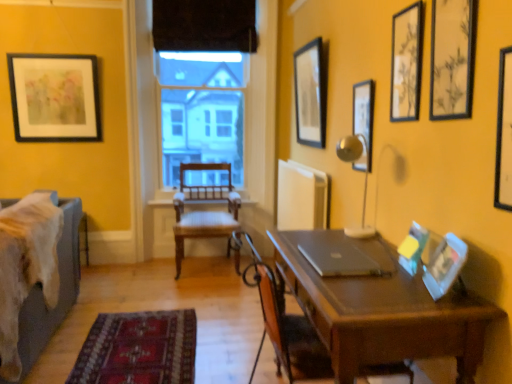
Question: From their relative heights in the image, would you say matte plastic picture frame at right, which appears as the fifth picture frame when viewed from the left, is taller or shorter than wooden picture frame at upper right, which is the 4th picture frame from back to front?

Choices:
 (A) tall
 (B) short

Answer: (B)

Question: Relative to wooden picture frame at upper right, acting as the sixth picture frame starting from the left, is matte plastic picture frame at right, which appears as the fourth picture frame when viewed from the right, in front or behind?

Choices:
 (A) front
 (B) behind

Answer: (A)

Question: Which is nearer to the brown wooden chair at center, placed as the 1th chair when sorted from front to back?

Choices:
 (A) wooden picture frame at upper right, acting as the seventh picture frame starting from the left
 (B) matte black picture frame at upper right, positioned as the 6th picture frame in right-to-left order
 (C) transparent glass window at center
 (D) matte plastic picture frame at right, the 4th picture frame when ordered from left to right
 (E) wooden chair at center

Answer: (D)

Question: Which is nearer to the velvet blue bed at left?

Choices:
 (A) matte black picture frame at upper right, positioned as the 6th picture frame in right-to-left order
 (B) transparent glass window at center
 (C) sleek silver laptop at center
 (D) wooden picture frame at upper right, acting as the 3th picture frame starting from the right
 (E) wooden picture frame at upper right, the 3th picture frame when ordered from front to back

Answer: (B)